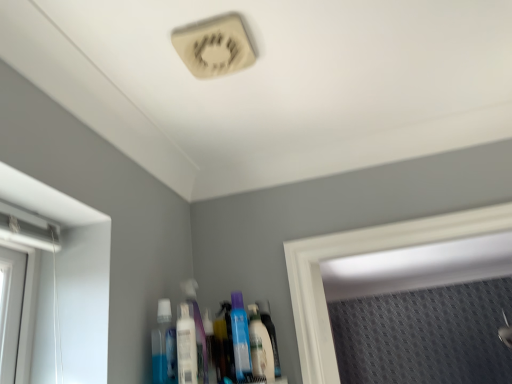
Question: In terms of height, does translucent plastic bottle at center look taller or shorter compared to white glossy mouthwash at lower center, the 3th mouthwash positioned from the left?

Choices:
 (A) tall
 (B) short

Answer: (A)

Question: Which is correct: translucent plastic bottle at center is inside white glossy mouthwash at lower center, the 1th mouthwash when ordered from right to left, or outside of it?

Choices:
 (A) outside
 (B) inside

Answer: (A)

Question: Which is farther from the white glossy mouthwash at lower center, the 3th mouthwash positioned from the left?

Choices:
 (A) white plastic mouthwash at center, the 2th mouthwash viewed from the right
 (B) translucent plastic bottle at center
 (C) translucent plastic bottle at center
 (D) blue translucent bottle at lower center, which ranks as the 3th mouthwash in right-to-left order

Answer: (D)

Question: Which of these objects is positioned farthest from the translucent plastic bottle at center?

Choices:
 (A) translucent plastic bottle at center
 (B) white plastic mouthwash at center, the 2th mouthwash viewed from the right
 (C) blue translucent bottle at lower center, which ranks as the 3th mouthwash in right-to-left order
 (D) white glossy mouthwash at lower center, the 1th mouthwash when ordered from right to left

Answer: (C)